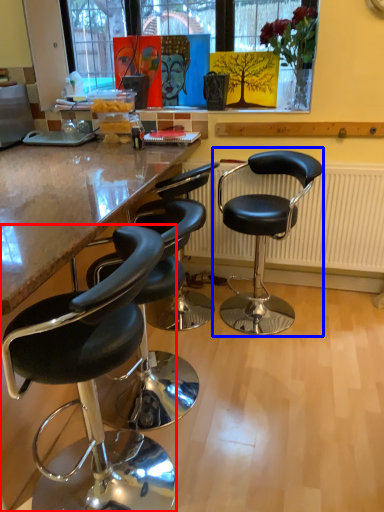
Question: Which object is closer to the camera taking this photo, chair (highlighted by a red box) or chair (highlighted by a blue box)?

Choices:
 (A) chair
 (B) chair

Answer: (A)